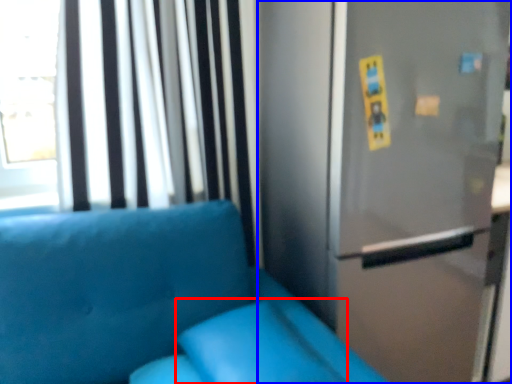
Question: Which object appears closest to the camera in this image, pillow (highlighted by a red box) or fridge (highlighted by a blue box)?

Choices:
 (A) pillow
 (B) fridge

Answer: (A)